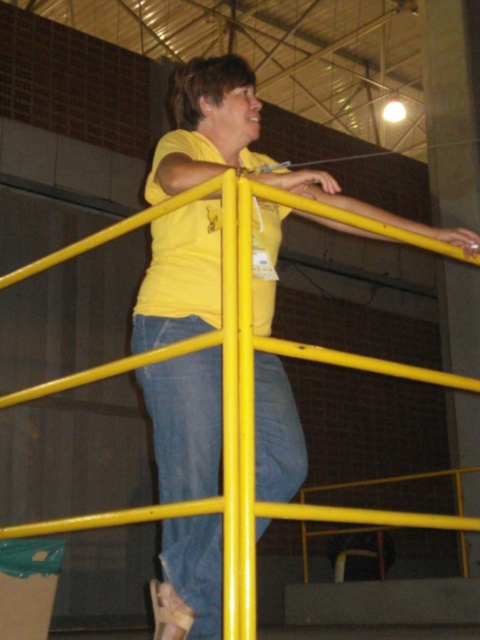
Question: Which point is closer to the camera taking this photo?

Choices:
 (A) (156, 273)
 (B) (171, 404)

Answer: (B)

Question: Does yellow matte shirt at upper center have a larger size compared to denim at center?

Choices:
 (A) no
 (B) yes

Answer: (B)

Question: Is yellow matte shirt at upper center smaller than denim at center?

Choices:
 (A) no
 (B) yes

Answer: (A)

Question: Which point is closer to the camera?

Choices:
 (A) (276, 497)
 (B) (219, 65)

Answer: (A)

Question: Considering the relative positions of yellow matte shirt at upper center and denim at center in the image provided, where is yellow matte shirt at upper center located with respect to denim at center?

Choices:
 (A) left
 (B) right

Answer: (B)